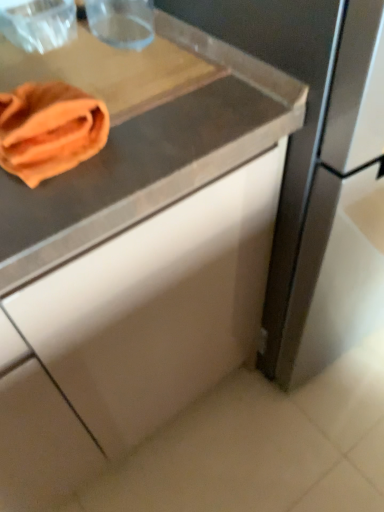
Where is `vacant space underneath orange cloth at upper left (from a real-world perspective)`? vacant space underneath orange cloth at upper left (from a real-world perspective) is located at coordinates (73, 71).